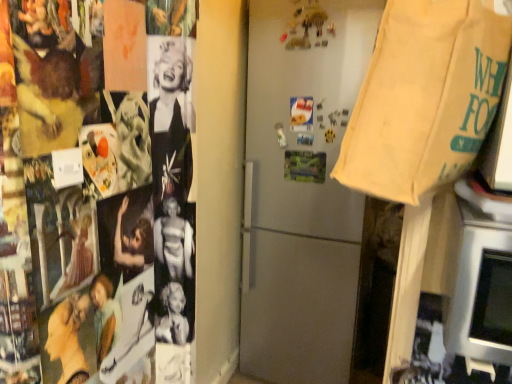
Question: From a real-world perspective, does silver metallic oven at lower right stand above satin silver refrigerator at center?

Choices:
 (A) no
 (B) yes

Answer: (B)

Question: Is satin silver refrigerator at center surrounded by silver metallic oven at lower right?

Choices:
 (A) yes
 (B) no

Answer: (B)

Question: Is silver metallic oven at lower right in front of satin silver refrigerator at center?

Choices:
 (A) no
 (B) yes

Answer: (B)

Question: From the image's perspective, does silver metallic oven at lower right appear higher than satin silver refrigerator at center?

Choices:
 (A) no
 (B) yes

Answer: (A)

Question: Can you confirm if silver metallic oven at lower right is bigger than satin silver refrigerator at center?

Choices:
 (A) no
 (B) yes

Answer: (A)

Question: From the image's perspective, does silver metallic oven at lower right appear lower than satin silver refrigerator at center?

Choices:
 (A) yes
 (B) no

Answer: (A)

Question: Does beige canvas grocery bag at upper right appear on the left side of satin silver refrigerator at center?

Choices:
 (A) no
 (B) yes

Answer: (A)

Question: Is beige canvas grocery bag at upper right facing away from satin silver refrigerator at center?

Choices:
 (A) no
 (B) yes

Answer: (B)

Question: Considering the relative sizes of beige canvas grocery bag at upper right and satin silver refrigerator at center in the image provided, is beige canvas grocery bag at upper right smaller than satin silver refrigerator at center?

Choices:
 (A) yes
 (B) no

Answer: (A)

Question: Can you confirm if beige canvas grocery bag at upper right is shorter than satin silver refrigerator at center?

Choices:
 (A) yes
 (B) no

Answer: (A)

Question: Considering the relative sizes of beige canvas grocery bag at upper right and satin silver refrigerator at center in the image provided, is beige canvas grocery bag at upper right thinner than satin silver refrigerator at center?

Choices:
 (A) yes
 (B) no

Answer: (A)

Question: Is beige canvas grocery bag at upper right behind satin silver refrigerator at center?

Choices:
 (A) no
 (B) yes

Answer: (A)

Question: Considering the relative positions of satin silver refrigerator at center and silver metallic oven at lower right in the image provided, is satin silver refrigerator at center to the left of silver metallic oven at lower right from the viewer's perspective?

Choices:
 (A) yes
 (B) no

Answer: (A)